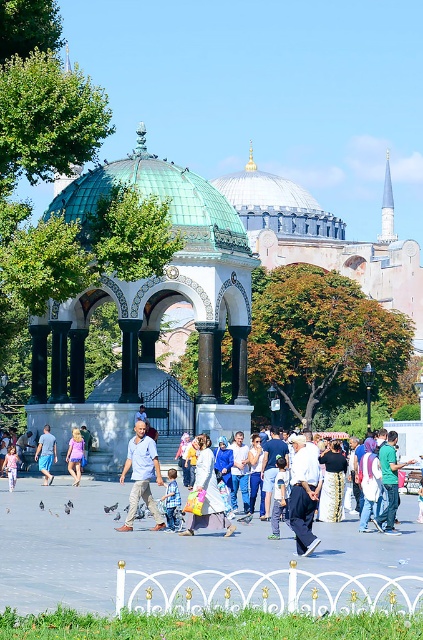
Question: Is white cotton dress at center behind blue cotton shirt at center?

Choices:
 (A) no
 (B) yes

Answer: (A)

Question: Does green mosaic gazebo at center appear on the right side of white cotton shirt at center?

Choices:
 (A) no
 (B) yes

Answer: (A)

Question: Among these objects, which one is farthest from the camera?

Choices:
 (A) green mosaic gazebo at center
 (B) white cotton dress at center
 (C) blue cotton shirt at center
 (D) white cotton shirt at center

Answer: (A)

Question: Which of the following is the farthest from the observer?

Choices:
 (A) green mosaic gazebo at center
 (B) denim shorts at center

Answer: (A)

Question: Can you confirm if white cotton dress at center is bigger than denim shorts at center?

Choices:
 (A) yes
 (B) no

Answer: (A)

Question: Which of the following is the farthest from the observer?

Choices:
 (A) white cotton shirt at center
 (B) green copper dome at center
 (C) green mosaic gazebo at center
 (D) white cotton dress at center

Answer: (C)